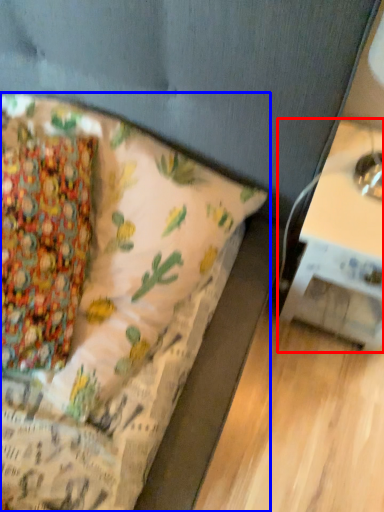
Question: Which of the following is the farthest to the observer, table (highlighted by a red box) or bed (highlighted by a blue box)?

Choices:
 (A) table
 (B) bed

Answer: (A)